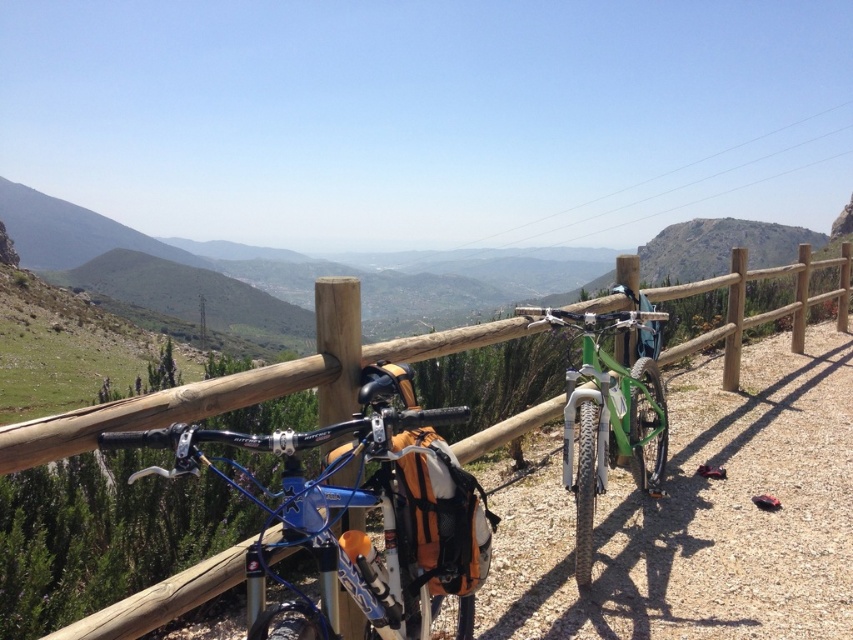
Question: Does wooden fence at center appear under green matte mountain bike at center?

Choices:
 (A) yes
 (B) no

Answer: (A)

Question: Can you confirm if green matte bicycle at center is bigger than wooden fence at center?

Choices:
 (A) no
 (B) yes

Answer: (B)

Question: From the image, what is the correct spatial relationship of green matte bicycle at center in relation to blue metallic bicycle at center?

Choices:
 (A) left
 (B) right

Answer: (B)

Question: Which point is farther to the camera?

Choices:
 (A) wooden fence at center
 (B) blue metallic bicycle at center
 (C) green matte mountain bike at center

Answer: (C)

Question: Which object is the closest to the wooden fence at center?

Choices:
 (A) green matte mountain bike at center
 (B) blue metallic bicycle at center

Answer: (B)

Question: Estimate the real-world distances between objects in this image. Which object is closer to the wooden fence at center?

Choices:
 (A) green matte mountain bike at center
 (B) blue metallic bicycle at center
 (C) green matte bicycle at center

Answer: (B)